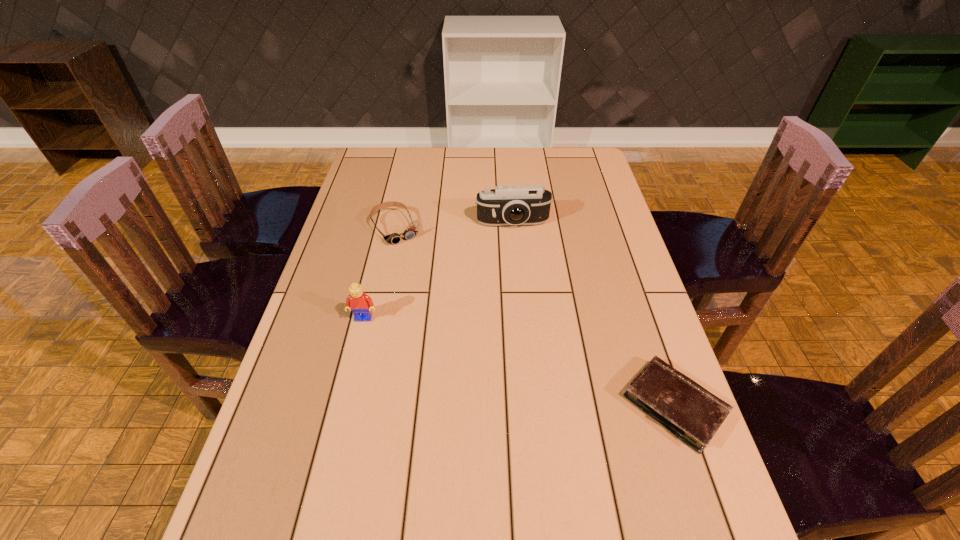
Identify the location of the second tallest object. This screenshot has width=960, height=540. (360, 304).

Find the location of a particular element. The width and height of the screenshot is (960, 540). the second nearest object is located at coordinates (360, 304).

Where is `the rightmost object`? The width and height of the screenshot is (960, 540). the rightmost object is located at coordinates (690, 412).

Where is `diary`? The width and height of the screenshot is (960, 540). diary is located at coordinates [690, 412].

This screenshot has width=960, height=540. Identify the location of the second object from right to left. (505, 205).

The width and height of the screenshot is (960, 540). In order to click on goggles in this screenshot , I will do `click(411, 231)`.

Image resolution: width=960 pixels, height=540 pixels. Identify the location of vacant space situated on the front-facing side of the Lego. [357, 345].

In order to click on blank space located on the back of the shortest object in this screenshot , I will do `click(644, 318)`.

Locate an element on the screen. Image resolution: width=960 pixels, height=540 pixels. vacant region located 0.310m on the front lens of the third object from left to right is located at coordinates (528, 307).

The image size is (960, 540). Identify the location of free space located on the front lens of the third object from left to right. (528, 307).